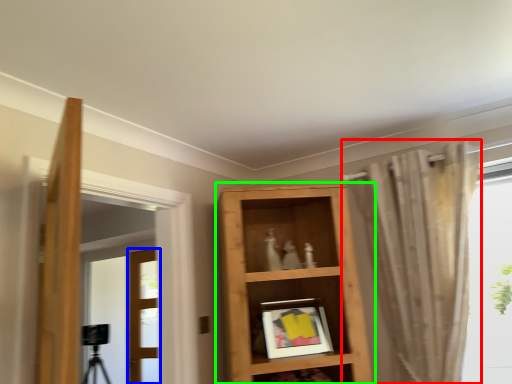
Question: Considering the real-world distances, which object is closest to curtain (highlighted by a red box)? door (highlighted by a blue box) or shelf (highlighted by a green box).

Choices:
 (A) door
 (B) shelf

Answer: (B)